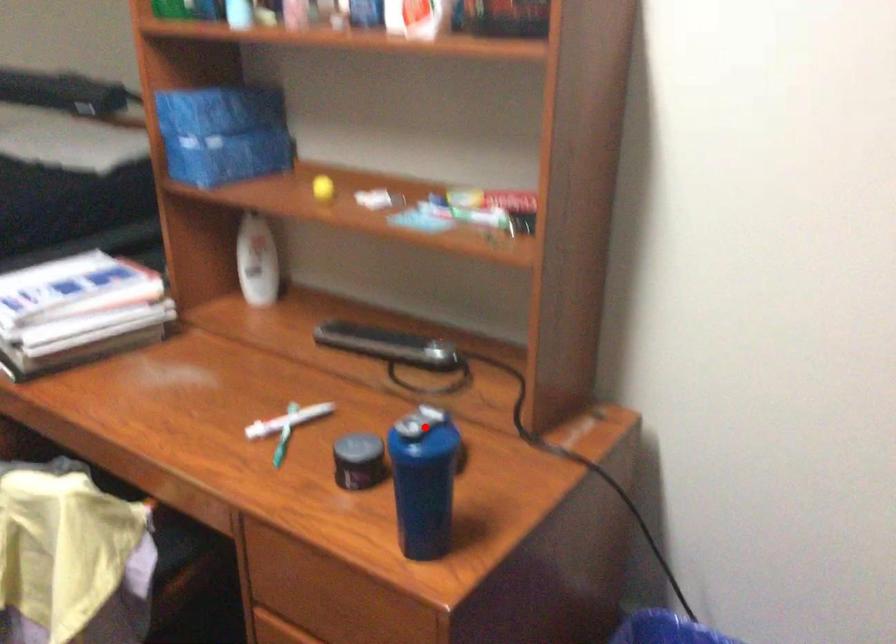
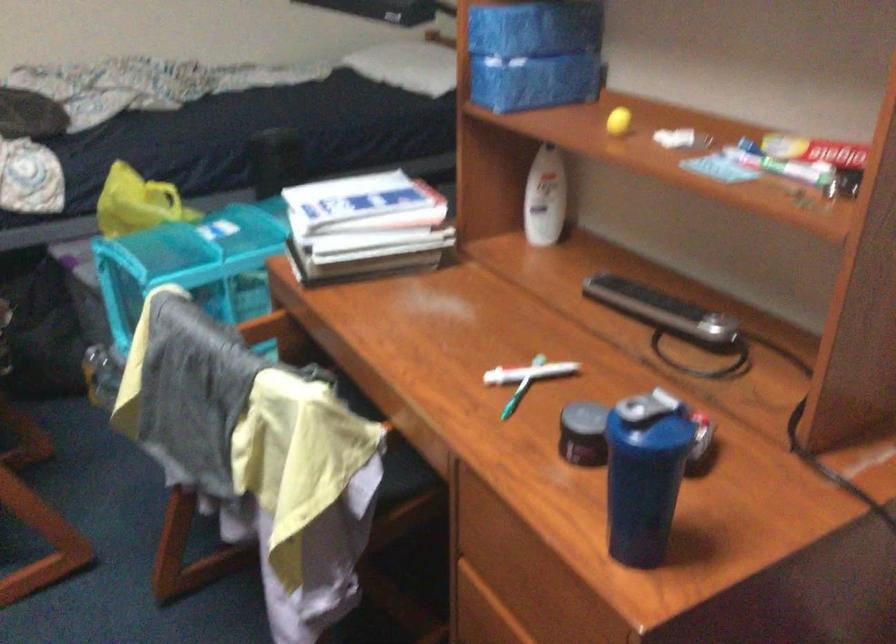
Question: A red point is marked in image1. In image2, is the corresponding 3D point closer to the camera or farther? Reply with the corresponding letter.

Choices:
 (A) The corresponding 3D point is closer.
 (B) The corresponding 3D point is farther.

Answer: (A)